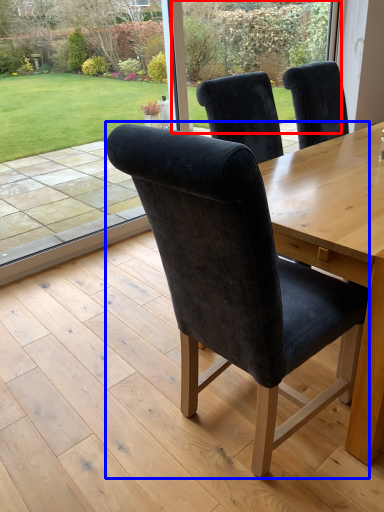
Question: Which of the following is the closest to the observer, glass door (highlighted by a red box) or chair (highlighted by a blue box)?

Choices:
 (A) glass door
 (B) chair

Answer: (B)